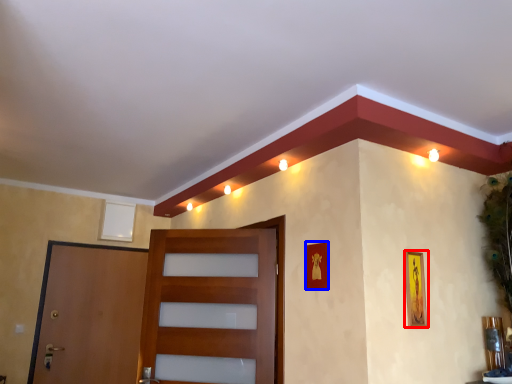
Question: Which of the following is the closest to the observer, picture frame (highlighted by a red box) or picture frame (highlighted by a blue box)?

Choices:
 (A) picture frame
 (B) picture frame

Answer: (A)